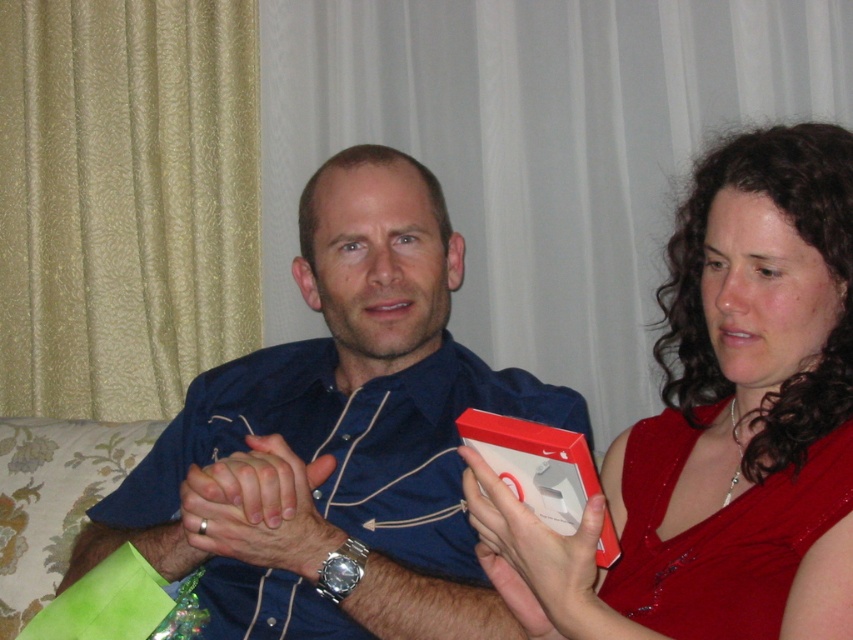
Who is more forward, (386, 564) or (741, 545)?

Point (741, 545) is in front.

Can you confirm if blue satin shirt at center is thinner than shiny red dress at upper right?

No.

Describe the element at coordinates (335, 440) in the screenshot. I see `blue satin shirt at center` at that location.

The image size is (853, 640). In order to click on blue satin shirt at center in this screenshot , I will do [x=335, y=440].

Does shiny red dress at upper right have a greater width compared to matte blue shirt at center?

Indeed, shiny red dress at upper right has a greater width compared to matte blue shirt at center.

Is shiny red dress at upper right above matte blue shirt at center?

Yes, shiny red dress at upper right is above matte blue shirt at center.

Which is behind, point (728, 573) or point (222, 460)?

Point (222, 460)

Locate an element on the screen. shiny red dress at upper right is located at coordinates (720, 426).

In the scene shown: Who is more distant from viewer, (x=511, y=500) or (x=315, y=563)?

The point (x=315, y=563) is behind.

Between point (614, 509) and point (254, 465), which one is positioned in front?

Point (254, 465)

You are a GUI agent. You are given a task and a screenshot of the screen. Output one action in this format:
    pyautogui.click(x=<x>, y=<y>)
    Task: Click on the matte white box at center
    
    Given the screenshot: What is the action you would take?
    pyautogui.click(x=537, y=556)